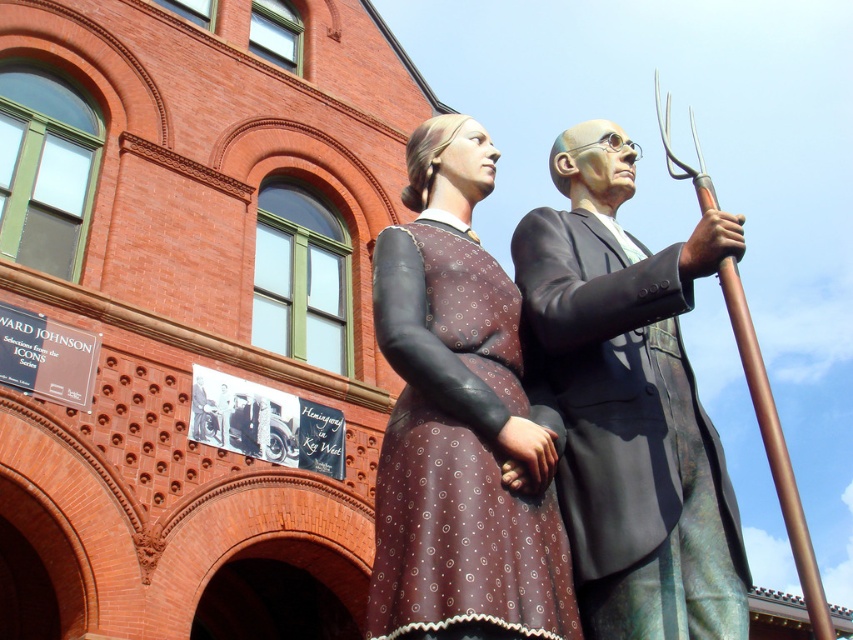
Can you confirm if shiny bronze suit at center is taller than matte brown dress at center?

In fact, shiny bronze suit at center may be shorter than matte brown dress at center.

You are a GUI agent. You are given a task and a screenshot of the screen. Output one action in this format:
    pyautogui.click(x=<x>, y=<y>)
    Task: Click on the shiny bronze suit at center
    The height and width of the screenshot is (640, 853).
    Given the screenshot: What is the action you would take?
    pyautogui.click(x=630, y=403)

Which is behind, point (625, 531) or point (415, 531)?

The point (625, 531) is more distant.

The width and height of the screenshot is (853, 640). What are the coordinates of `shiny bronze suit at center` in the screenshot? It's located at (630, 403).